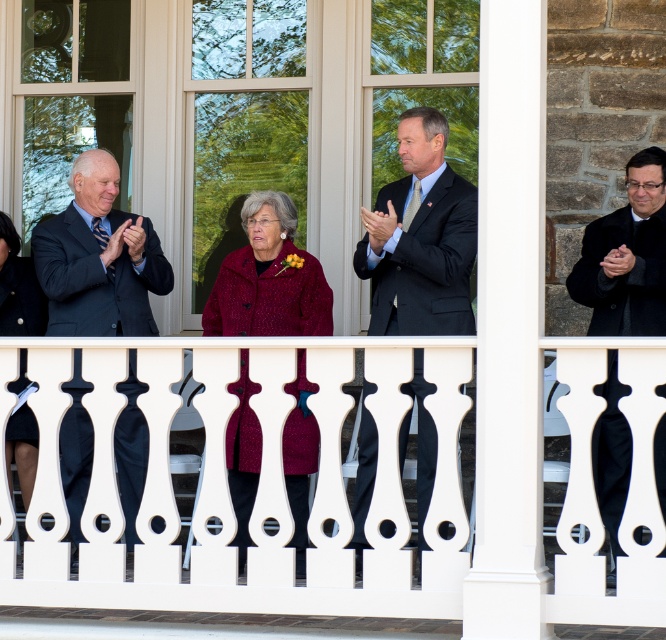
Can you confirm if dark blue suit at center is positioned to the right of dark blue suit at left?

Yes, dark blue suit at center is to the right of dark blue suit at left.

Is point (454, 324) more distant than point (141, 449)?

No, it is in front of (141, 449).

What do you see at coordinates (420, 237) in the screenshot? I see `dark blue suit at center` at bounding box center [420, 237].

Where is `dark blue suit at center`? The image size is (666, 640). dark blue suit at center is located at coordinates (420, 237).

From the picture: Does white painted wood railing at center lie in front of dark blue suit at left?

Yes, it is in front of dark blue suit at left.

Is point (442, 417) less distant than point (117, 330)?

Yes, point (442, 417) is in front of point (117, 330).

At what (x,y) coordinates should I click in order to perform the action: click on white painted wood railing at center. Please return your answer as a coordinate pair (x, y). This screenshot has width=666, height=640. Looking at the image, I should click on pyautogui.click(x=328, y=492).

Locate an element on the screen. The image size is (666, 640). white painted wood railing at center is located at coordinates (328, 492).

The width and height of the screenshot is (666, 640). What do you see at coordinates (99, 259) in the screenshot?
I see `dark blue suit at left` at bounding box center [99, 259].

Which is in front, point (91, 460) or point (33, 456)?

Point (91, 460) is in front.

Image resolution: width=666 pixels, height=640 pixels. Find the location of `dark blue suit at left`. dark blue suit at left is located at coordinates (99, 259).